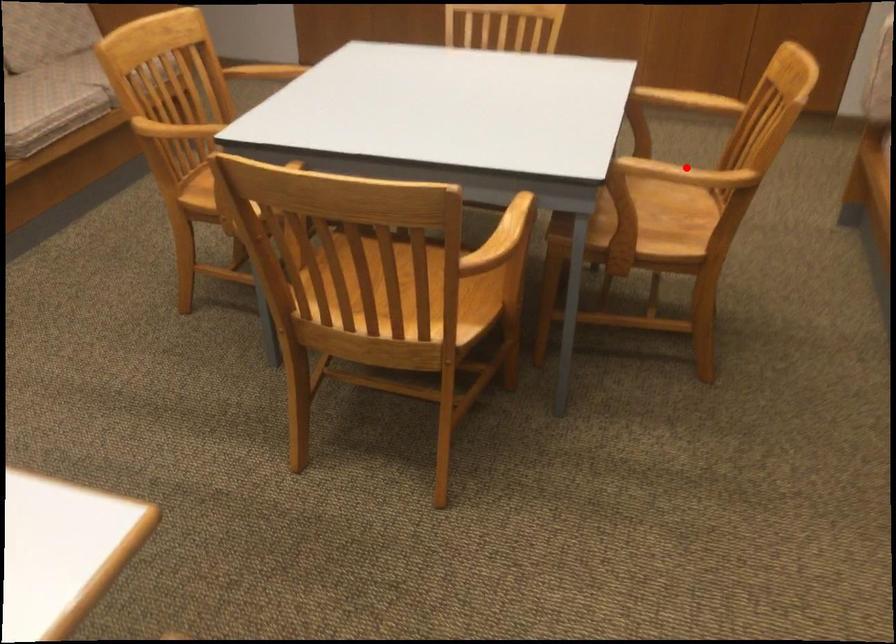
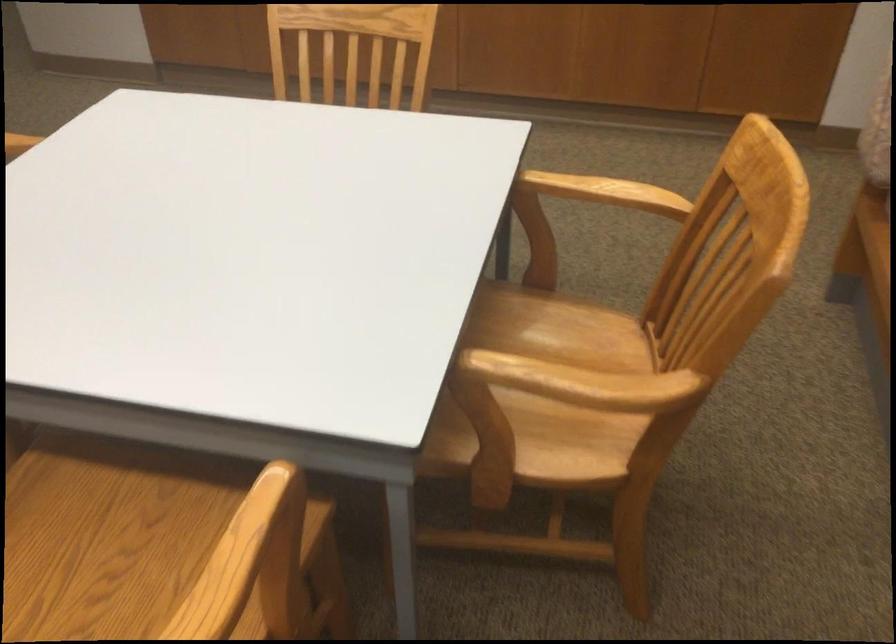
Locate, in the second image, the point that corresponds to the highlighted location in the first image.

(583, 383)